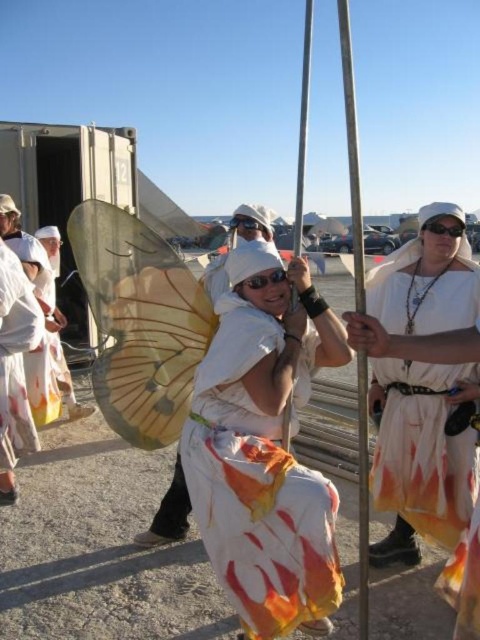
You are a photographer at the festival and want to capture the white cotton dress at center and the metallic pole at center in the same frame. Which object should you focus on first if you want to include both in your shot?

The white cotton dress at center is positioned on the left side of metallic pole at center, so you should focus on the metallic pole at center first to ensure both objects are in the frame.

You are a performer at the festival holding a white paper fan at center and a metallic pole at center. You need to hand your fan to a friend standing 1.5 meters away from you. Can you reach them without moving your feet?

The white paper fan at center and metallic pole at center are 1.34 meters apart from each other. Since the friend is 1.5 meters away, which is slightly farther than the distance between the fan and the pole, you might not be able to reach them without moving your feet.

You are a photographer at the festival and want to capture the white cotton dress at center and the white fabric wings at center in a single photo. Can you ensure both are clearly visible in focus?

The white cotton dress at center is in front of the white fabric wings at center, so if you focus on the dress, the wings might be slightly out of focus. Adjust your camera settings to ensure both are in focus by using a smaller aperture or a focus point that covers both objects.